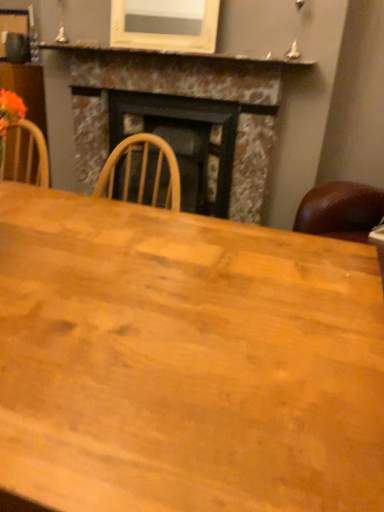
Question: Can you confirm if marble fireplace at center is positioned to the right of wooden table at center?

Choices:
 (A) yes
 (B) no

Answer: (B)

Question: Does marble fireplace at center have a greater height compared to wooden table at center?

Choices:
 (A) no
 (B) yes

Answer: (B)

Question: Considering the relative sizes of marble fireplace at center and wooden table at center in the image provided, is marble fireplace at center shorter than wooden table at center?

Choices:
 (A) no
 (B) yes

Answer: (A)

Question: Does marble fireplace at center come in front of wooden table at center?

Choices:
 (A) yes
 (B) no

Answer: (B)

Question: From the image's perspective, is marble fireplace at center located above wooden table at center?

Choices:
 (A) yes
 (B) no

Answer: (A)

Question: Do you think marble mantel at upper center is within marble fireplace at center, or outside of it?

Choices:
 (A) inside
 (B) outside

Answer: (B)

Question: Is marble mantel at upper center in front of or behind marble fireplace at center in the image?

Choices:
 (A) front
 (B) behind

Answer: (A)

Question: In terms of width, does marble mantel at upper center look wider or thinner when compared to marble fireplace at center?

Choices:
 (A) thin
 (B) wide

Answer: (A)

Question: From the image's perspective, is marble mantel at upper center positioned above or below marble fireplace at center?

Choices:
 (A) above
 (B) below

Answer: (A)

Question: Is wooden table at center wider or thinner than marble fireplace at center?

Choices:
 (A) wide
 (B) thin

Answer: (A)

Question: Relative to marble fireplace at center, is wooden table at center in front or behind?

Choices:
 (A) front
 (B) behind

Answer: (A)

Question: Considering the positions of point (127, 390) and point (69, 53), is point (127, 390) closer or farther from the camera than point (69, 53)?

Choices:
 (A) closer
 (B) farther

Answer: (A)

Question: Is wooden table at center inside or outside of marble fireplace at center?

Choices:
 (A) inside
 (B) outside

Answer: (B)

Question: Does point (271, 72) appear closer or farther from the camera than point (284, 352)?

Choices:
 (A) farther
 (B) closer

Answer: (A)

Question: Considering their positions, is marble fireplace at center located in front of or behind wooden table at center?

Choices:
 (A) front
 (B) behind

Answer: (B)